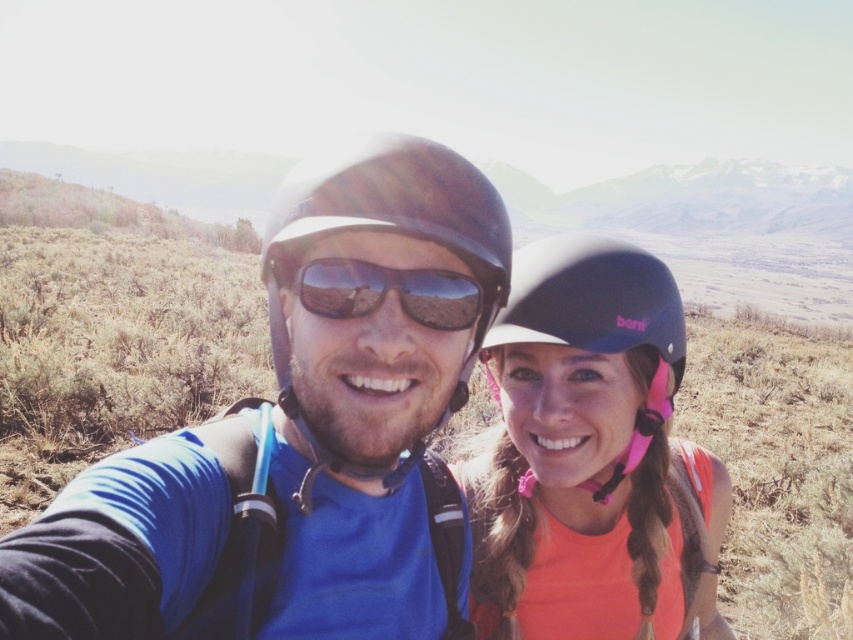
Between matte blue helmet at left and matte blue helmet at right, which one is positioned lower?

Positioned lower is matte blue helmet at right.

Between point (317, 620) and point (625, 273), which one is positioned in front?

Point (317, 620) is more forward.

Where is `matte blue helmet at left`? This screenshot has width=853, height=640. matte blue helmet at left is located at coordinates (302, 435).

Which of these two, matte blue helmet at right or matte black helmet at center, stands shorter?

Standing shorter between the two is matte black helmet at center.

Does matte blue helmet at right come behind matte black helmet at center?

Yes, it is behind matte black helmet at center.

Is point (549, 538) more distant than point (271, 259)?

Yes, it is.

Where is `matte blue helmet at right`? matte blue helmet at right is located at coordinates (590, 458).

The height and width of the screenshot is (640, 853). Find the location of `matte blue helmet at right`. matte blue helmet at right is located at coordinates (590, 458).

Between point (498, 580) and point (341, 296), which one is positioned behind?

The point (498, 580) is behind.

Where is `matte blue helmet at right`? The height and width of the screenshot is (640, 853). matte blue helmet at right is located at coordinates (590, 458).